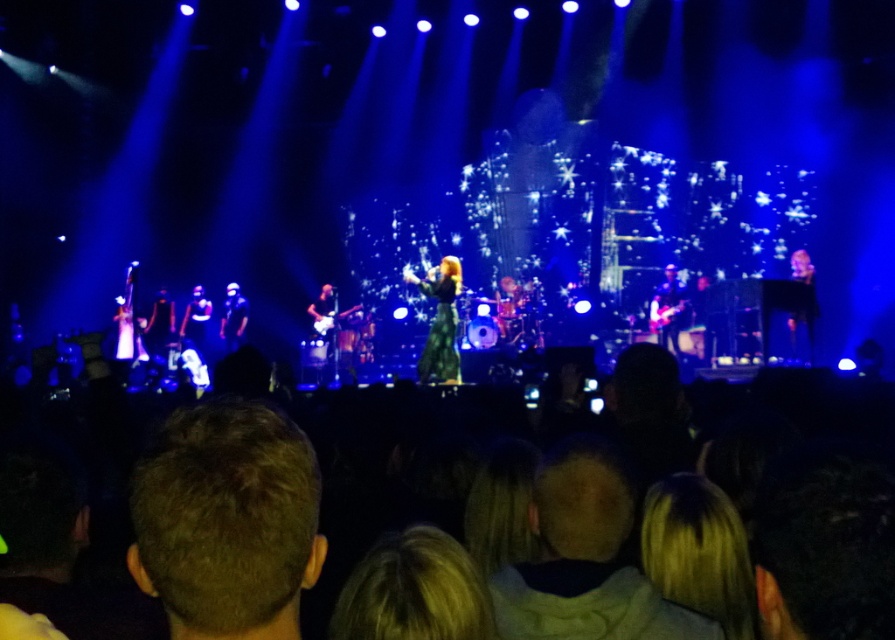
Question: Which object is positioned farthest from the shiny black jacket at center?

Choices:
 (A) shiny black guitar at left
 (B) shiny black dress at right
 (C) green textured dress at center
 (D) shiny black guitar at center

Answer: (B)

Question: Can you confirm if shiny black guitar at center is positioned to the left of shiny black dress at right?

Choices:
 (A) yes
 (B) no

Answer: (A)

Question: Which object appears closest to the camera in this image?

Choices:
 (A) shiny black guitar at center
 (B) shiny black jacket at center
 (C) shiny black guitar at left

Answer: (A)

Question: Can you confirm if green textured dress at center is thinner than shiny black jacket at center?

Choices:
 (A) no
 (B) yes

Answer: (A)

Question: Does shiny black guitar at center appear on the right side of shiny black jacket at center?

Choices:
 (A) no
 (B) yes

Answer: (B)

Question: Which of the following is the closest to the observer?

Choices:
 (A) (407, 275)
 (B) (226, 308)

Answer: (A)